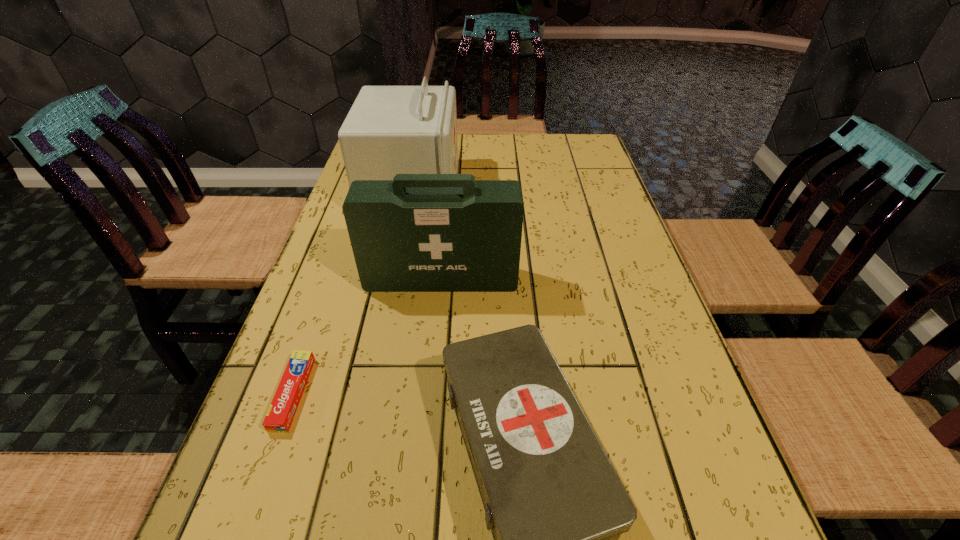
The height and width of the screenshot is (540, 960). Find the location of `vacant area at the left edge`. vacant area at the left edge is located at coordinates (309, 314).

Where is `vacant space at the right edge of the desktop`? This screenshot has height=540, width=960. vacant space at the right edge of the desktop is located at coordinates (605, 232).

In the image, there is a desktop. Identify the location of vacant space at the far right corner. (563, 164).

Where is `empty space between the third nearest object and the toothpaste`? Image resolution: width=960 pixels, height=540 pixels. empty space between the third nearest object and the toothpaste is located at coordinates (367, 336).

Identify the location of free spot between the toothpaste and the third nearest object. This screenshot has height=540, width=960. (367, 336).

Locate which object is the second closest to the second farthest first-aid kit. Please provide its 2D coordinates. Your answer should be formatted as a tuple, i.e. [(x, y)], where the tuple contains the x and y coordinates of a point satisfying the conditions above.

[(556, 507)]

You are a GUI agent. You are given a task and a screenshot of the screen. Output one action in this format:
    pyautogui.click(x=<x>, y=<y>)
    Task: Click on the object that stands as the closest to the farthest first-aid kit
    
    Given the screenshot: What is the action you would take?
    pyautogui.click(x=418, y=232)

Identify which first-aid kit is located as the nearest to the second shortest object. Please provide its 2D coordinates. Your answer should be formatted as a tuple, i.e. [(x, y)], where the tuple contains the x and y coordinates of a point satisfying the conditions above.

[(418, 232)]

This screenshot has width=960, height=540. Find the location of `the first-aid kit that stands as the closest to the second shortest object`. the first-aid kit that stands as the closest to the second shortest object is located at coordinates (418, 232).